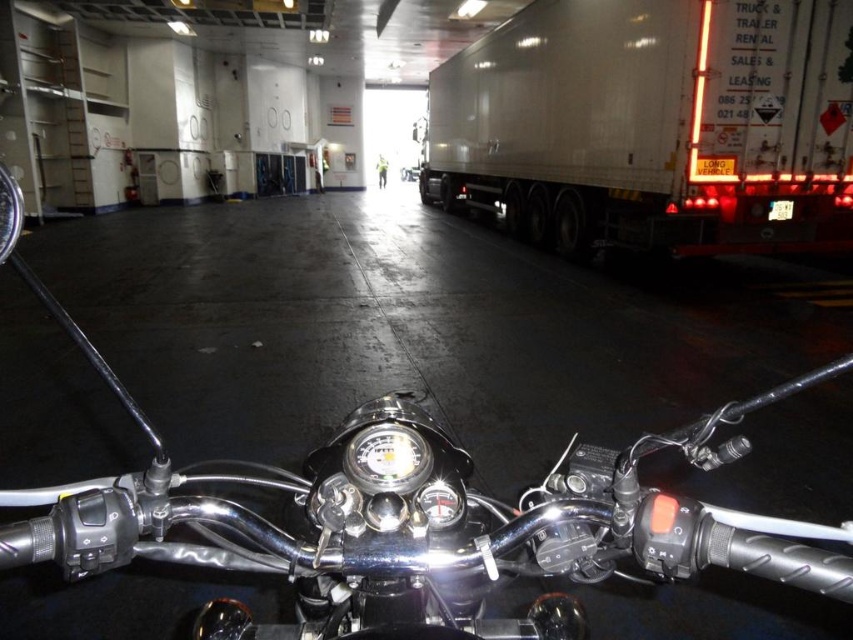
Question: Which is farther from the metallic silver headlight at center?

Choices:
 (A) white glossy trailer truck at right
 (B) polished chrome motorcycle at center

Answer: (A)

Question: Among these objects, which one is nearest to the camera?

Choices:
 (A) metallic silver headlight at center
 (B) white glossy trailer truck at right

Answer: (A)

Question: Is polished chrome motorcycle at center positioned at the back of metallic silver headlight at center?

Choices:
 (A) yes
 (B) no

Answer: (B)

Question: Which object is farther from the camera taking this photo?

Choices:
 (A) polished chrome motorcycle at center
 (B) white glossy trailer truck at right

Answer: (B)

Question: Can you confirm if polished chrome motorcycle at center is positioned to the right of white glossy trailer truck at right?

Choices:
 (A) no
 (B) yes

Answer: (A)

Question: Can you confirm if polished chrome motorcycle at center is wider than metallic silver headlight at center?

Choices:
 (A) yes
 (B) no

Answer: (A)